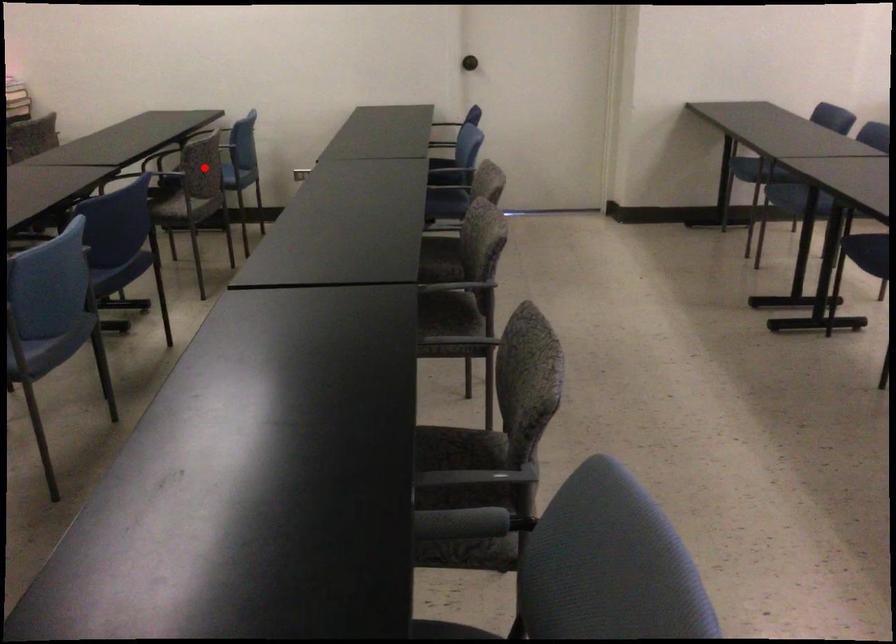
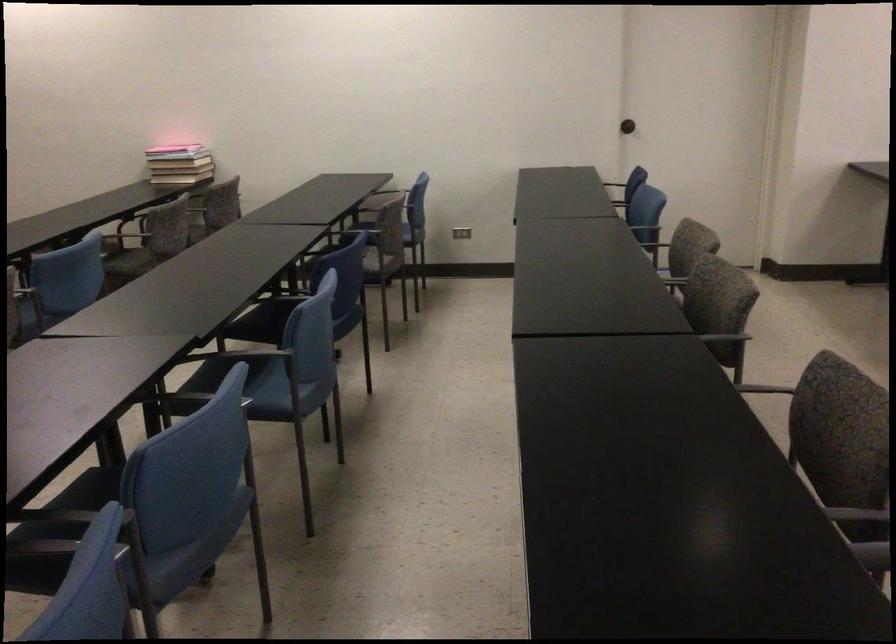
The point at the highlighted location is marked in the first image. Where is the corresponding point in the second image?

(398, 225)